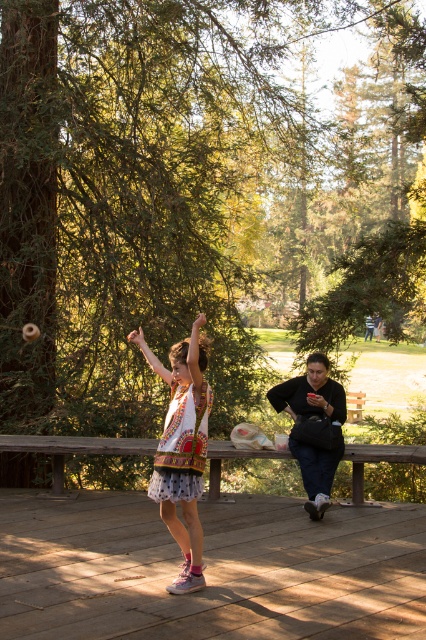
Is wooden deck at lower center bigger than white printed dress at center?

Incorrect, wooden deck at lower center is not larger than white printed dress at center.

Does wooden deck at lower center have a greater height compared to white printed dress at center?

Incorrect, wooden deck at lower center's height is not larger of white printed dress at center's.

The image size is (426, 640). What are the coordinates of `wooden deck at lower center` in the screenshot? It's located at (210, 570).

Is white printed dress at center below dark blue sweater at center?

No.

Consider the image. Is white printed dress at center to the left of dark blue sweater at center from the viewer's perspective?

Indeed, white printed dress at center is positioned on the left side of dark blue sweater at center.

Between point (198, 580) and point (330, 380), which one is positioned behind?

Point (330, 380)

You are a GUI agent. You are given a task and a screenshot of the screen. Output one action in this format:
    pyautogui.click(x=<x>, y=<y>)
    Task: Click on the white printed dress at center
    
    Given the screenshot: What is the action you would take?
    pyautogui.click(x=181, y=448)

The height and width of the screenshot is (640, 426). What do you see at coordinates (210, 570) in the screenshot? I see `wooden deck at lower center` at bounding box center [210, 570].

At what (x,y) coordinates should I click in order to perform the action: click on wooden deck at lower center. Please return your answer as a coordinate pair (x, y). Looking at the image, I should click on (210, 570).